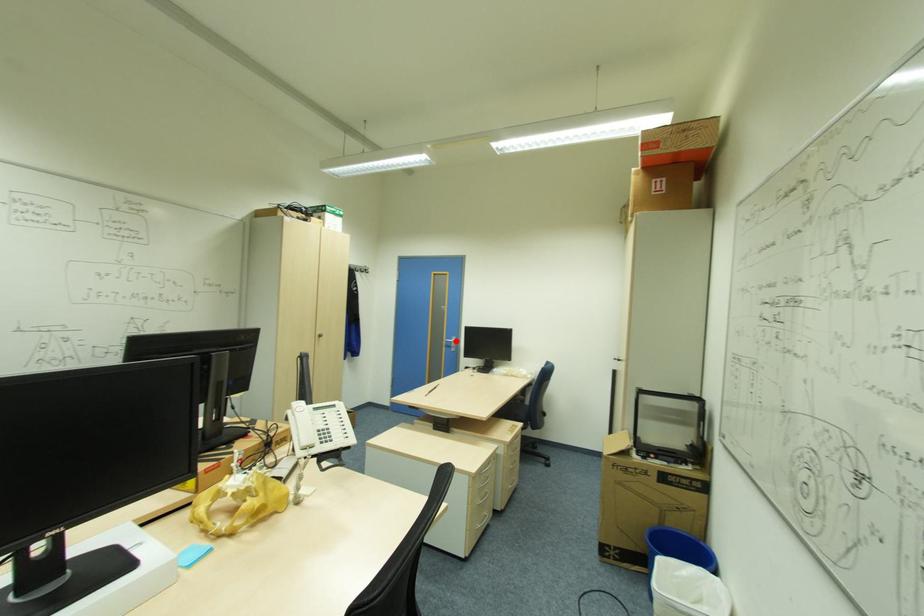
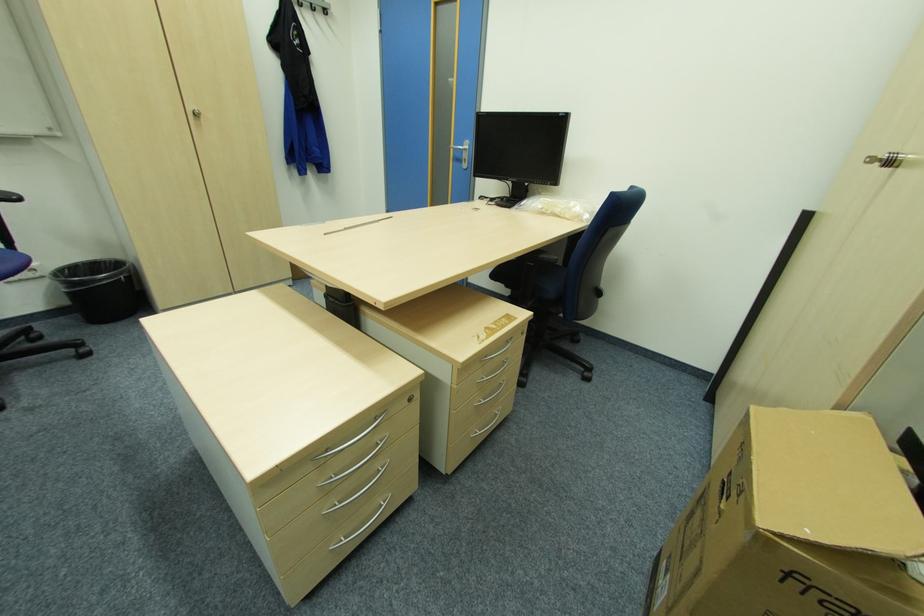
Question: I am providing you with two images of the same scene from different viewpoints. A red point is shown in image1. For the corresponding object point in image2, is it positioned nearer or farther from the camera?

Choices:
 (A) Nearer
 (B) Farther

Answer: (A)